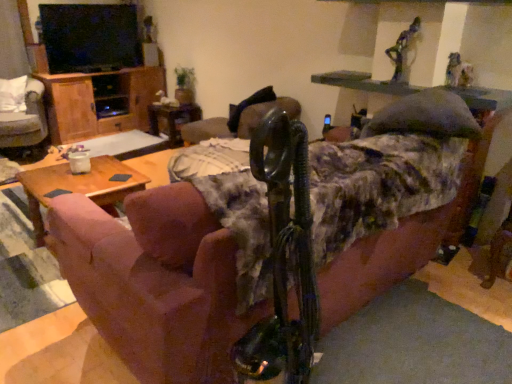
The width and height of the screenshot is (512, 384). What do you see at coordinates (26, 127) in the screenshot? I see `white fabric chair at left, the first chair viewed from the left` at bounding box center [26, 127].

This screenshot has width=512, height=384. What do you see at coordinates (239, 121) in the screenshot? I see `metallic statue at center, which is the 1th chair from right to left` at bounding box center [239, 121].

What do you see at coordinates (156, 281) in the screenshot?
I see `pink fabric couch at center` at bounding box center [156, 281].

Where is `white fabric chair at left, the first chair viewed from the left`? The width and height of the screenshot is (512, 384). white fabric chair at left, the first chair viewed from the left is located at coordinates (26, 127).

Which object is more forward, wooden side table at center or woodenwoodentable at left?

woodenwoodentable at left is more forward.

Can you confirm if wooden side table at center is shorter than woodenwoodentable at left?

Yes, wooden side table at center is shorter than woodenwoodentable at left.

Is point (199, 107) closer or farther from the camera than point (141, 183)?

Point (199, 107).

Between wooden side table at center and woodenwoodentable at left, which one has larger width?

woodenwoodentable at left is wider.

Considering the sizes of objects pink fabric couch at center and metallic statue at center, which is the 2th chair in left-to-right order, in the image provided, who is wider, pink fabric couch at center or metallic statue at center, which is the 2th chair in left-to-right order,?

Wider between the two is pink fabric couch at center.

Does pink fabric couch at center turn towards metallic statue at center, which is the 2th chair in left-to-right order?

Yes, pink fabric couch at center faces towards metallic statue at center, which is the 2th chair in left-to-right order.

Is pink fabric couch at center bigger or smaller than metallic statue at center, which is the 2th chair in left-to-right order?

Clearly, pink fabric couch at center is larger in size than metallic statue at center, which is the 2th chair in left-to-right order.

Is pink fabric couch at center spatially inside metallic statue at center, which is the 1th chair from right to left, or outside of it?

pink fabric couch at center is located beyond the bounds of metallic statue at center, which is the 1th chair from right to left.

Where is `table below the wooden cabinet at left (from the image's perspective)`? Image resolution: width=512 pixels, height=384 pixels. table below the wooden cabinet at left (from the image's perspective) is located at coordinates (79, 186).

Considering the points (56, 102) and (60, 164), which point is in front, point (56, 102) or point (60, 164)?

The point (60, 164) is in front.

From the image's perspective, is wooden cabinet at left below woodenwoodentable at left?

Incorrect, from the image's perspective, wooden cabinet at left is higher than woodenwoodentable at left.

From a real-world perspective, which is physically below, wooden cabinet at left or woodenwoodentable at left?

In real-world perspective, woodenwoodentable at left is lower.

Do you think woodenwoodentable at left is within metallic statue at center, which is the 2th chair in left-to-right order, or outside of it?

woodenwoodentable at left cannot be found inside metallic statue at center, which is the 2th chair in left-to-right order.

Considering the positions of point (29, 202) and point (200, 120), is point (29, 202) closer or farther from the camera than point (200, 120)?

Point (29, 202) is positioned closer to the camera compared to point (200, 120).

Which object is closer to the camera taking this photo, woodenwoodentable at left or metallic statue at center, which is the 2th chair in left-to-right order?

woodenwoodentable at left is in front.

Is woodenwoodentable at left facing away from metallic statue at center, which is the 2th chair in left-to-right order?

No, woodenwoodentable at left is not facing the opposite direction of metallic statue at center, which is the 2th chair in left-to-right order.

Is woodenwoodentable at left far from pink fabric couch at center?

They are positioned close to each other.

Can you confirm if woodenwoodentable at left is shorter than pink fabric couch at center?

Correct, woodenwoodentable at left is not as tall as pink fabric couch at center.

Considering their positions, is woodenwoodentable at left located in front of or behind pink fabric couch at center?

woodenwoodentable at left is behind pink fabric couch at center.

How different are the orientations of woodenwoodentable at left and pink fabric couch at center in degrees?

The facing directions of woodenwoodentable at left and pink fabric couch at center are 0.253 degrees apart.

What's the angular difference between wooden side table at center and wooden cabinet at left's facing directions?

0.951 degrees.

Locate an element on the screen. The image size is (512, 384). side table that appears below the wooden cabinet at left (from the image's perspective) is located at coordinates (172, 119).

Between wooden side table at center and wooden cabinet at left, which one is positioned behind?

wooden side table at center is more distant.

Based on the photo, is wooden side table at center not within wooden cabinet at left?

Yes, wooden side table at center is not within wooden cabinet at left.

Does white fabric chair at left, positioned as the second chair in right-to-left order, contain woodenwoodentable at left?

That's incorrect, woodenwoodentable at left is not inside white fabric chair at left, positioned as the second chair in right-to-left order.

Which object is closer to the camera, white fabric chair at left, the first chair viewed from the left, or woodenwoodentable at left?

Positioned in front is woodenwoodentable at left.

From the image's perspective, does white fabric chair at left, positioned as the second chair in right-to-left order, appear higher than woodenwoodentable at left?

Indeed, from the image's perspective, white fabric chair at left, positioned as the second chair in right-to-left order, is shown above woodenwoodentable at left.

Does point (33, 122) appear closer or farther from the camera than point (127, 186)?

Point (33, 122) is farther from the camera than point (127, 186).

The height and width of the screenshot is (384, 512). I want to click on table on the left of wooden side table at center, so click(79, 186).

Image resolution: width=512 pixels, height=384 pixels. Identify the location of studio couch on the right of metallic statue at center, which is the 1th chair from right to left. (156, 281).

When comparing their distances from white fabric chair at left, the first chair viewed from the left, does pink fabric couch at center or metallic statue at center, which is the 2th chair in left-to-right order, seem closer?

metallic statue at center, which is the 2th chair in left-to-right order, lies closer to white fabric chair at left, the first chair viewed from the left, than the other object.

From the image, which object appears to be farther from pink fabric couch at center, woodenwoodentable at left or wooden side table at center?

wooden side table at center.

When comparing their distances from woodenwoodentable at left, does metallic statue at center, which is the 1th chair from right to left, or pink fabric couch at center seem closer?

Among the two, pink fabric couch at center is located nearer to woodenwoodentable at left.

Which object lies nearer to the anchor point woodenwoodentable at left, white fabric chair at left, positioned as the second chair in right-to-left order, or wooden side table at center?

white fabric chair at left, positioned as the second chair in right-to-left order, is closer to woodenwoodentable at left.

Considering their positions, is wooden side table at center positioned closer to white fabric chair at left, positioned as the second chair in right-to-left order, than metallic statue at center, which is the 2th chair in left-to-right order?

The object closer to white fabric chair at left, positioned as the second chair in right-to-left order, is wooden side table at center.

Estimate the real-world distances between objects in this image. Which object is further from pink fabric couch at center, woodenwoodentable at left or wooden cabinet at left?

wooden cabinet at left is positioned further to the anchor pink fabric couch at center.

Based on their spatial positions, is pink fabric couch at center or metallic statue at center, which is the 2th chair in left-to-right order, further from wooden side table at center?

Based on the image, pink fabric couch at center appears to be further to wooden side table at center.

Based on their spatial positions, is white fabric chair at left, positioned as the second chair in right-to-left order, or wooden cabinet at left closer to metallic statue at center, which is the 1th chair from right to left?

wooden cabinet at left.

Where is `table between white fabric chair at left, the first chair viewed from the left, and metallic statue at center, which is the 1th chair from right to left`? table between white fabric chair at left, the first chair viewed from the left, and metallic statue at center, which is the 1th chair from right to left is located at coordinates (79, 186).

The height and width of the screenshot is (384, 512). I want to click on dresser located between white fabric chair at left, positioned as the second chair in right-to-left order, and wooden side table at center in the left-right direction, so click(x=99, y=102).

Find the location of a particular element. table between pink fabric couch at center and white fabric chair at left, the first chair viewed from the left, in the front-back direction is located at coordinates (79, 186).

In order to click on table between pink fabric couch at center and wooden cabinet at left along the z-axis in this screenshot , I will do `click(79, 186)`.